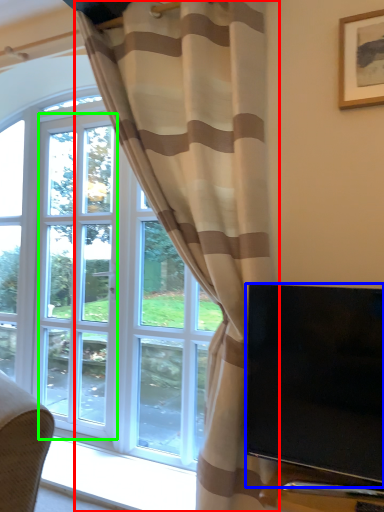
Question: Which object is positioned farthest from curtain (highlighted by a red box)? Select from television (highlighted by a blue box) and screen door (highlighted by a green box).

Choices:
 (A) television
 (B) screen door

Answer: (B)